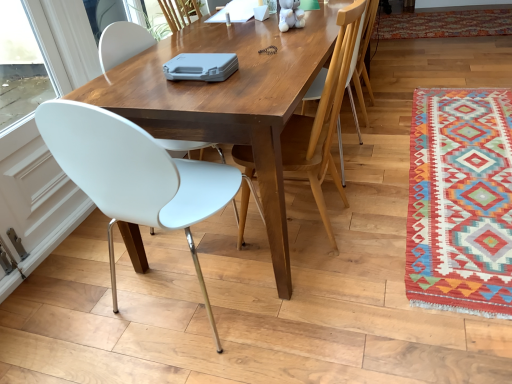
Question: Is multicolored woven rug at right, placed as the 2th mat when sorted from bottom to top, in front of or behind wooden chair at upper right, the 3th chair in the left-to-right sequence, in the image?

Choices:
 (A) front
 (B) behind

Answer: (B)

Question: Is multicolored woven rug at right, the first mat viewed from the top, taller or shorter than wooden chair at upper right, the 3th chair in the left-to-right sequence?

Choices:
 (A) tall
 (B) short

Answer: (B)

Question: Which of these objects is positioned farthest from the multicolored woven rug at lower right, acting as the 2th mat starting from the top?

Choices:
 (A) white plastic chair at left, which is the 3th chair in right-to-left order
 (B) wooden chair at upper right, marked as the first chair in a right-to-left arrangement
 (C) multicolored woven rug at right, the 2th mat viewed from the front
 (D) wooden table at center
 (E) white plastic chair at center, placed as the second chair when sorted from left to right

Answer: (C)

Question: Which is farther from the multicolored woven rug at right, the first mat viewed from the top?

Choices:
 (A) white plastic chair at center, placed as the second chair when sorted from left to right
 (B) wooden table at center
 (C) multicolored woven rug at lower right, which is counted as the 1th mat, starting from the front
 (D) white plastic chair at left, which is the 3th chair in right-to-left order
 (E) wooden chair at upper right, the 3th chair in the left-to-right sequence

Answer: (D)